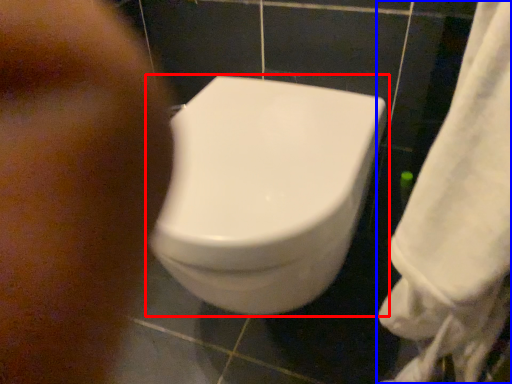
Question: Which object appears farthest to the camera in this image, toilet (highlighted by a red box) or towel (highlighted by a blue box)?

Choices:
 (A) toilet
 (B) towel

Answer: (A)